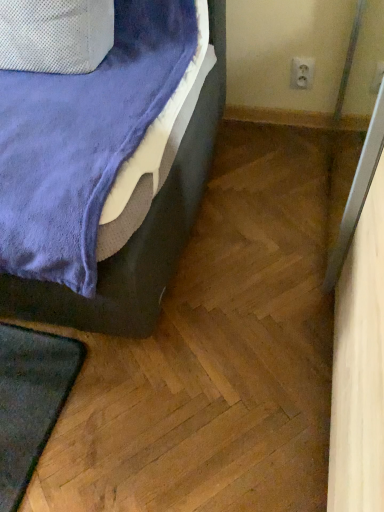
Question: Considering the positions of white plastic electric outlet at upper right and velvet blue bed at lower left in the image, is white plastic electric outlet at upper right wider or thinner than velvet blue bed at lower left?

Choices:
 (A) wide
 (B) thin

Answer: (B)

Question: Considering the positions of white plastic electric outlet at upper right and velvet blue bed at lower left in the image, is white plastic electric outlet at upper right bigger or smaller than velvet blue bed at lower left?

Choices:
 (A) big
 (B) small

Answer: (B)

Question: Is white plastic electric outlet at upper right in front of or behind velvet blue bed at lower left in the image?

Choices:
 (A) behind
 (B) front

Answer: (A)

Question: Is velvet blue bed at lower left bigger or smaller than white plastic electric outlet at upper right?

Choices:
 (A) big
 (B) small

Answer: (A)

Question: Is velvet blue bed at lower left situated inside white plastic electric outlet at upper right or outside?

Choices:
 (A) inside
 (B) outside

Answer: (B)

Question: From the image's perspective, is velvet blue bed at lower left located above or below white plastic electric outlet at upper right?

Choices:
 (A) below
 (B) above

Answer: (A)

Question: From a real-world perspective, is velvet blue bed at lower left positioned above or below white plastic electric outlet at upper right?

Choices:
 (A) below
 (B) above

Answer: (B)